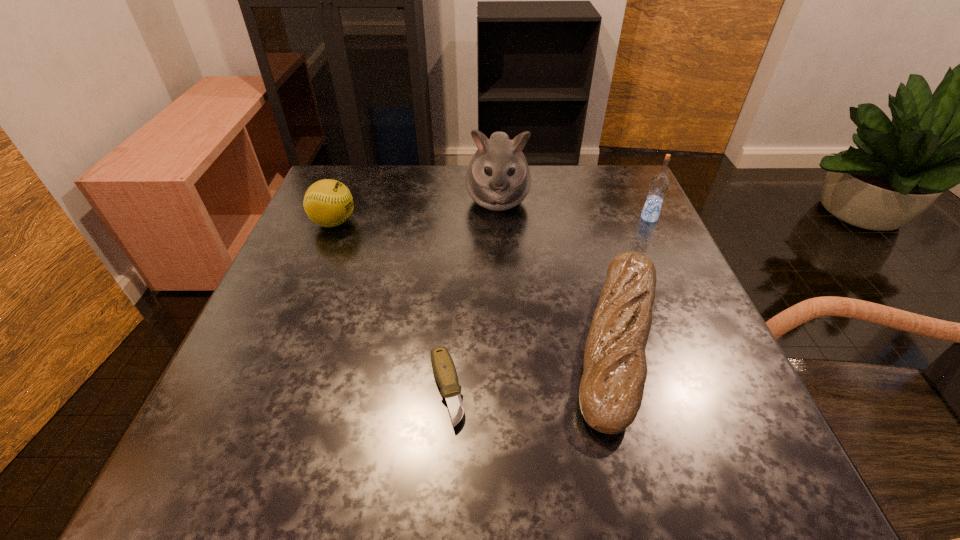
The width and height of the screenshot is (960, 540). I want to click on baguet that is at the right edge, so click(x=611, y=390).

Locate an element on the screen. object at the far left corner is located at coordinates (328, 203).

At what (x,y) coordinates should I click in order to perform the action: click on object positioned at the far right corner. Please return your answer as a coordinate pair (x, y). The height and width of the screenshot is (540, 960). Looking at the image, I should click on (659, 184).

In order to click on object present at the near right corner in this screenshot , I will do `click(611, 390)`.

Locate an element on the screen. This screenshot has height=540, width=960. vacant space at the far edge of the desktop is located at coordinates (515, 211).

In order to click on vacant space at the near edge in this screenshot , I will do pyautogui.click(x=542, y=468).

In the image, there is a desktop. Identify the location of vacant space at the left edge. The height and width of the screenshot is (540, 960). (301, 421).

The height and width of the screenshot is (540, 960). I want to click on free space at the right edge, so click(683, 361).

Where is `vacant space at the far left corner of the desktop`? This screenshot has width=960, height=540. vacant space at the far left corner of the desktop is located at coordinates click(x=367, y=207).

The image size is (960, 540). In order to click on vacant space at the far right corner of the desktop in this screenshot , I will do `click(592, 195)`.